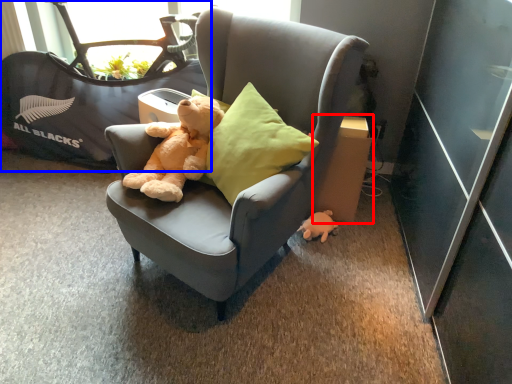
Question: Which object appears closest to the camera in this image, cardboard box (highlighted by a red box) or baby carriage (highlighted by a blue box)?

Choices:
 (A) cardboard box
 (B) baby carriage

Answer: (A)